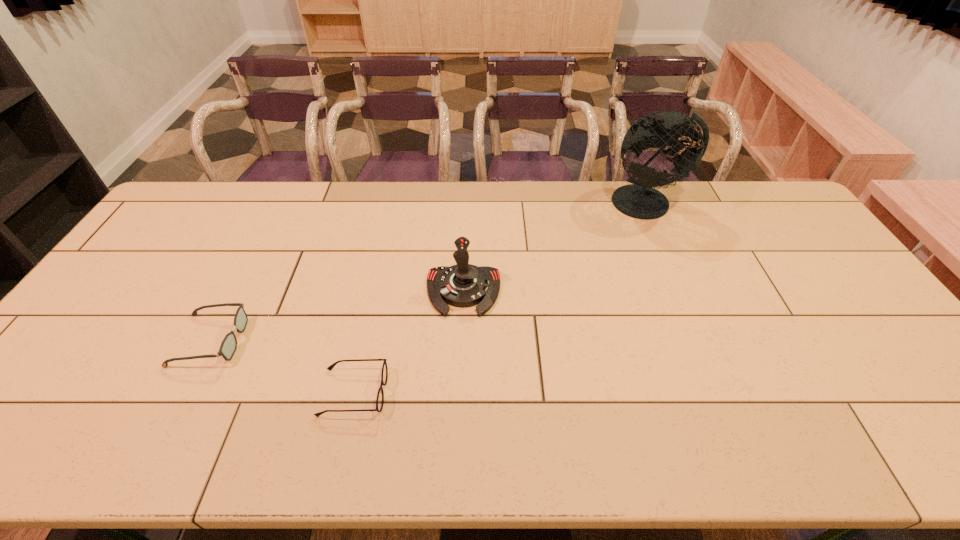
Where is `globe`? The width and height of the screenshot is (960, 540). globe is located at coordinates (639, 200).

The width and height of the screenshot is (960, 540). In order to click on the tallest object in this screenshot , I will do `click(639, 200)`.

Where is `the third shortest object`? The image size is (960, 540). the third shortest object is located at coordinates (462, 285).

Locate an element on the screen. This screenshot has width=960, height=540. joystick is located at coordinates (462, 285).

Image resolution: width=960 pixels, height=540 pixels. I want to click on the leftmost object, so click(228, 346).

I want to click on the shortest object, so click(x=384, y=374).

Find the location of a particular element. the shorter spectacles is located at coordinates [x=384, y=374].

I want to click on vacant region located on the front-facing side of the farthest object, so click(x=663, y=238).

Find the location of a particular element. The width and height of the screenshot is (960, 540). vacant space located 0.380m on the handle side of the third shortest object is located at coordinates (458, 457).

At what (x,y) coordinates should I click in order to perform the action: click on free space located on the face of the leftmost object. Please return your answer as a coordinate pair (x, y). Image resolution: width=960 pixels, height=540 pixels. Looking at the image, I should click on (353, 340).